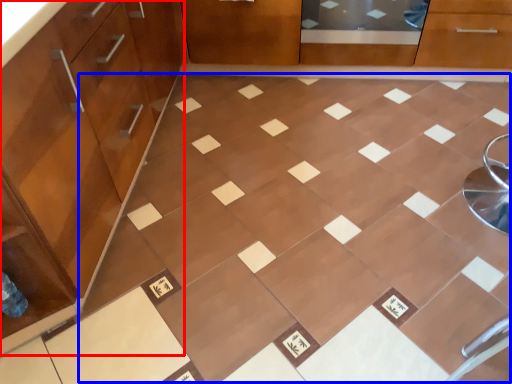
Question: Which object appears farthest to the camera in this image, cabinetry (highlighted by a red box) or ceramic tile (highlighted by a blue box)?

Choices:
 (A) cabinetry
 (B) ceramic tile

Answer: (B)